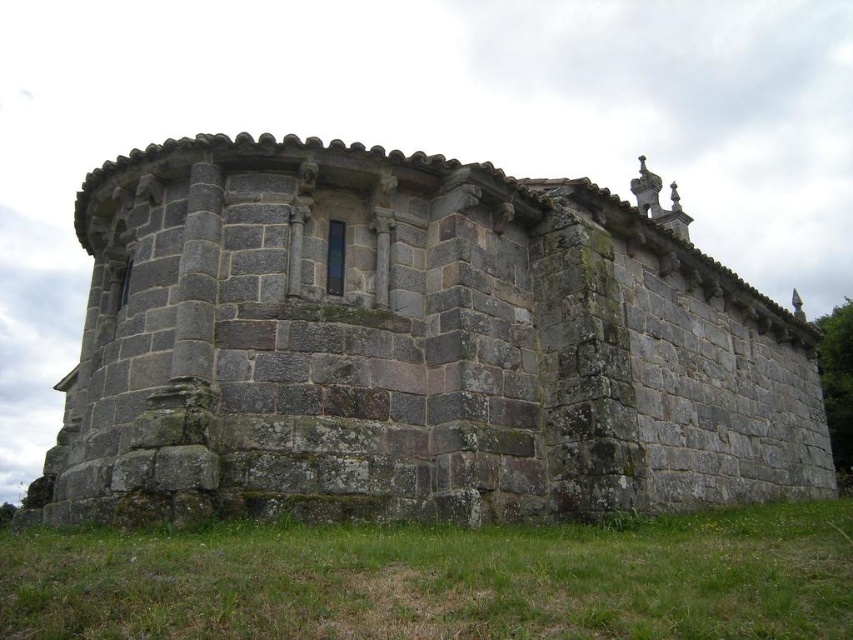
Can you confirm if gray stone building at center is thinner than green grass at lower center?

No, gray stone building at center is not thinner than green grass at lower center.

Which is in front, point (273, 436) or point (390, 548)?

Point (390, 548) is in front.

Who is more distant from viewer, (223, 336) or (24, 605)?

Point (223, 336)

Where is `gray stone building at center`? Image resolution: width=853 pixels, height=640 pixels. gray stone building at center is located at coordinates (413, 348).